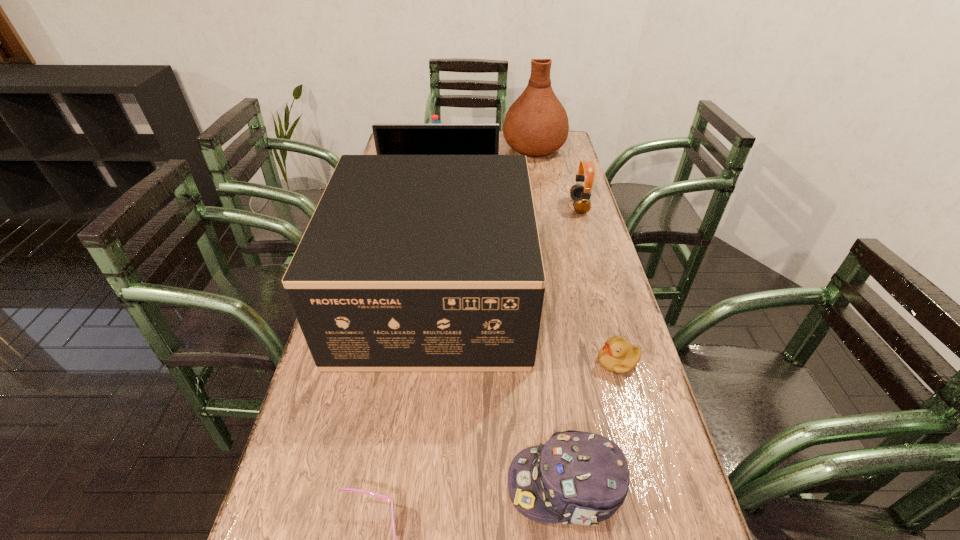
This screenshot has height=540, width=960. What are the coordinates of `free region located on the ear cups of the headset` in the screenshot? It's located at (468, 206).

The width and height of the screenshot is (960, 540). Find the location of `blank area located 0.190m on the ear cups of the headset`. blank area located 0.190m on the ear cups of the headset is located at coordinates (516, 206).

Identify the location of blank area located 0.330m on the ear cups of the headset. (474, 206).

Identify the location of free space located on the front-facing side of the third shortest object. This screenshot has height=540, width=960. point(381,485).

The height and width of the screenshot is (540, 960). I want to click on free region located 0.240m on the front-facing side of the third shortest object, so tap(381, 485).

Locate an element on the screen. free spot located 0.220m on the front-facing side of the third shortest object is located at coordinates (392, 485).

I want to click on free space located 0.150m at the beak of the duckling, so click(534, 361).

Where is `vacant space situated 0.230m at the beak of the duckling`? The width and height of the screenshot is (960, 540). vacant space situated 0.230m at the beak of the duckling is located at coordinates (500, 361).

Image resolution: width=960 pixels, height=540 pixels. Identify the location of blank space located at the beak of the duckling. (513, 361).

Where is `object positioned at the far edge`? This screenshot has height=540, width=960. object positioned at the far edge is located at coordinates (536, 124).